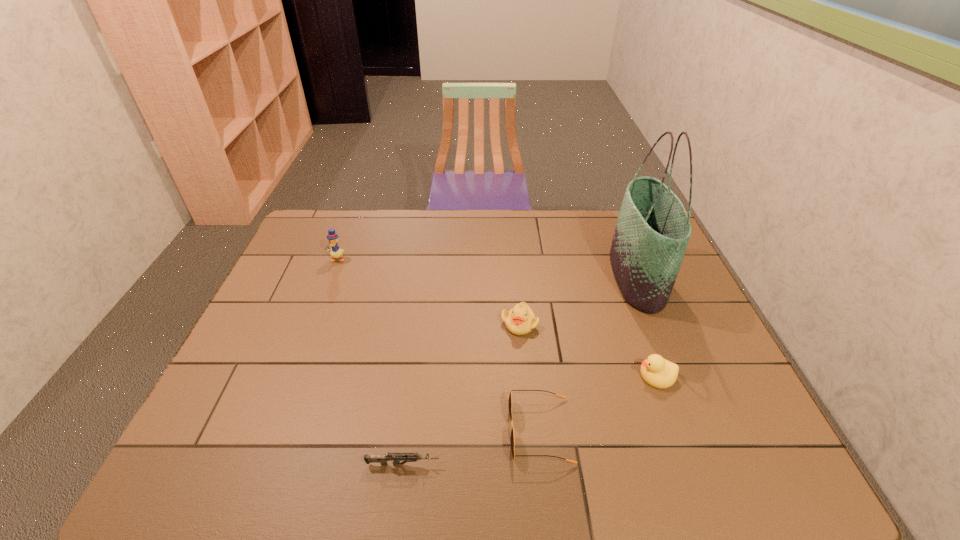
At what (x,y) coordinates should I click in order to perform the action: click on vacant area at the far left corner of the desktop. Please return your answer as a coordinate pair (x, y). This screenshot has width=960, height=540. Looking at the image, I should click on (305, 234).

Where is `free space between the tallest object and the sunglasses`? This screenshot has height=540, width=960. free space between the tallest object and the sunglasses is located at coordinates click(x=588, y=354).

This screenshot has width=960, height=540. Find the location of `vacant space that is in between the tallest object and the second shortest object`. vacant space that is in between the tallest object and the second shortest object is located at coordinates (588, 354).

The height and width of the screenshot is (540, 960). In order to click on vacant point located between the tote bag and the shortest object in this screenshot , I will do [x=520, y=371].

I want to click on free spot between the second nearest duckling and the gun, so click(x=462, y=394).

Locate an element on the screen. free space between the second duckling from right to left and the gun is located at coordinates (462, 394).

Locate an element on the screen. free space between the rightmost duckling and the second farthest duckling is located at coordinates (588, 349).

Locate an element on the screen. The image size is (960, 540). free space between the sunglasses and the second duckling from right to left is located at coordinates (530, 377).

The image size is (960, 540). Find the location of `vacant area between the sunglasses and the shortest object`. vacant area between the sunglasses and the shortest object is located at coordinates (471, 448).

The image size is (960, 540). I want to click on free space between the second nearest duckling and the shortest object, so click(x=462, y=394).